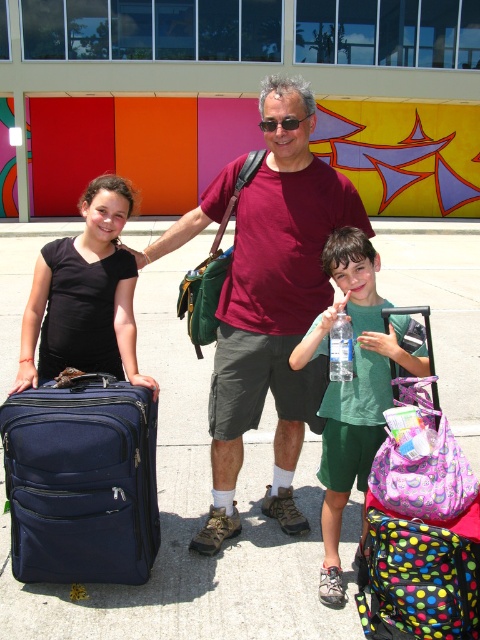
Does maroon t-shirt at center lie behind green fabric water bottle at center?

Yes, it is.

Is point (195, 230) closer to viewer compared to point (370, 424)?

No, it is behind (370, 424).

Locate an element on the screen. The image size is (480, 640). maroon t-shirt at center is located at coordinates (274, 307).

Between maroon t-shirt at center and black matte suitcase at left, which one appears on the right side from the viewer's perspective?

From the viewer's perspective, maroon t-shirt at center appears more on the right side.

This screenshot has height=640, width=480. Describe the element at coordinates (274, 307) in the screenshot. I see `maroon t-shirt at center` at that location.

Measure the distance between maroon t-shirt at center and camera.

maroon t-shirt at center is 9.24 feet from camera.

Find the location of a particular element. maroon t-shirt at center is located at coordinates (274, 307).

Between black matte suitcase at left and clear plastic bottle at center, which one appears on the left side from the viewer's perspective?

black matte suitcase at left is more to the left.

Based on the photo, is black matte suitcase at left above clear plastic bottle at center?

Yes.

Who is more forward, (123, 365) or (336, 320)?

Positioned in front is point (336, 320).

Where is `black matte suitcase at left`? The height and width of the screenshot is (640, 480). black matte suitcase at left is located at coordinates (84, 296).